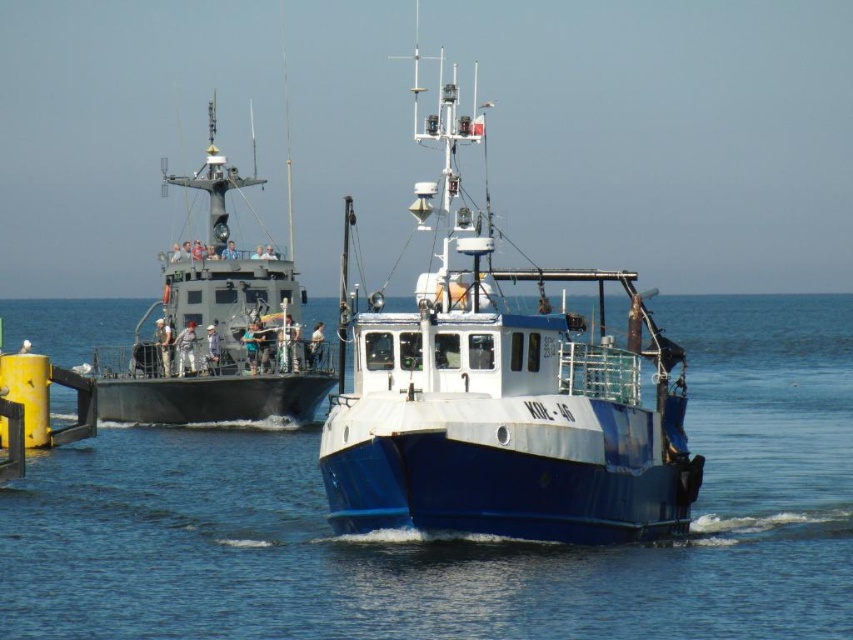
You are a sailor trying to navigate through the blue water at center. There is a matte gray boat at left nearby. Based on their heights, which one is taller?

The matte gray boat at left is taller than the blue water at center.